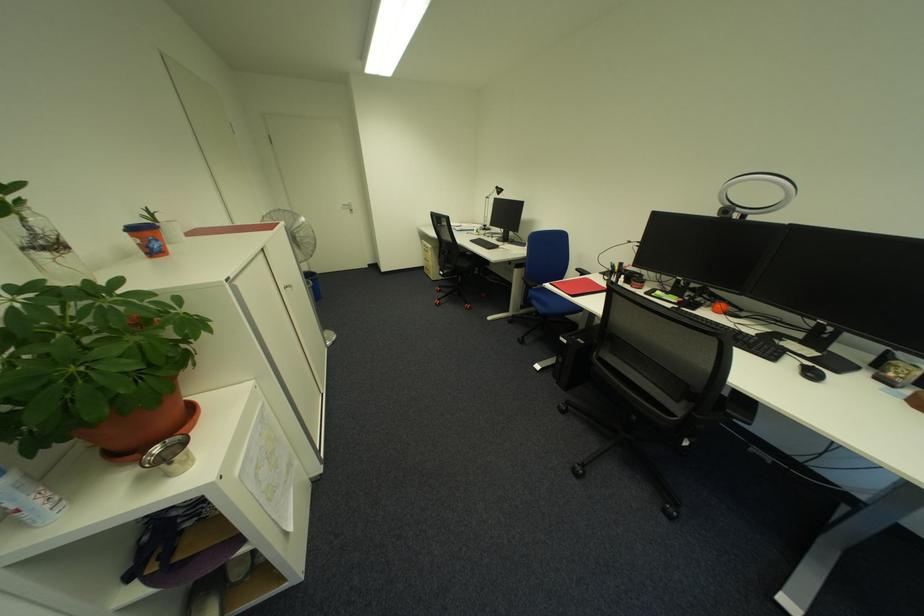
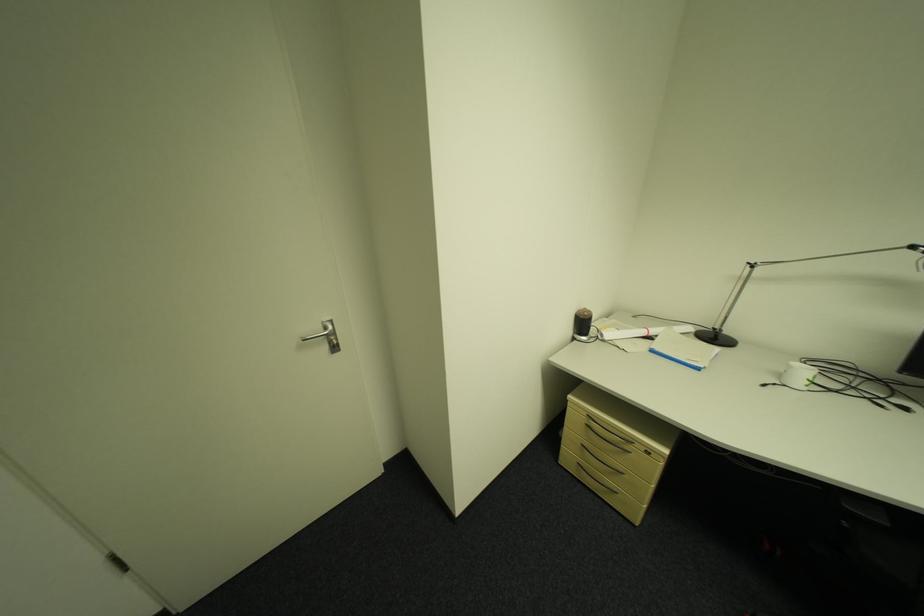
Where in the second image is the point corresponding to (359,211) from the first image?

(335, 349)